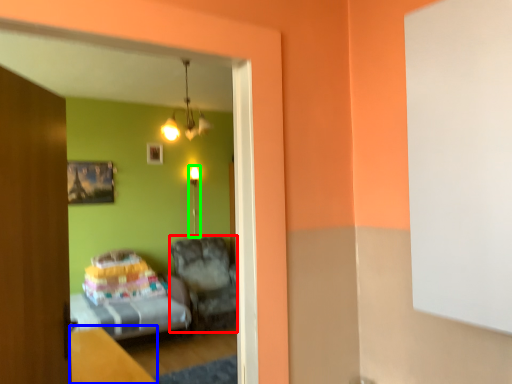
Question: Which is farther away from furniture (highlighted by a red box)? table (highlighted by a blue box) or light fixture (highlighted by a green box)?

Choices:
 (A) table
 (B) light fixture

Answer: (A)